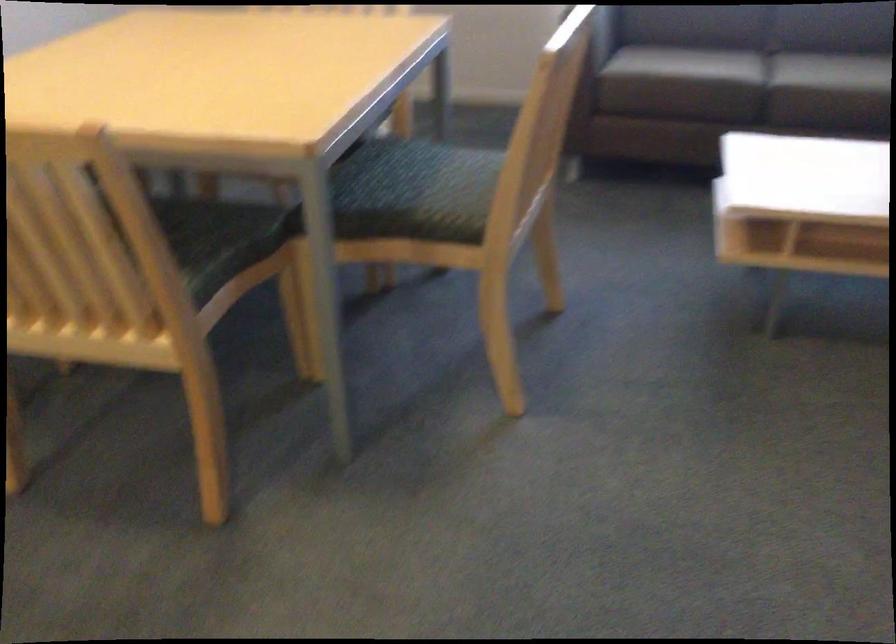
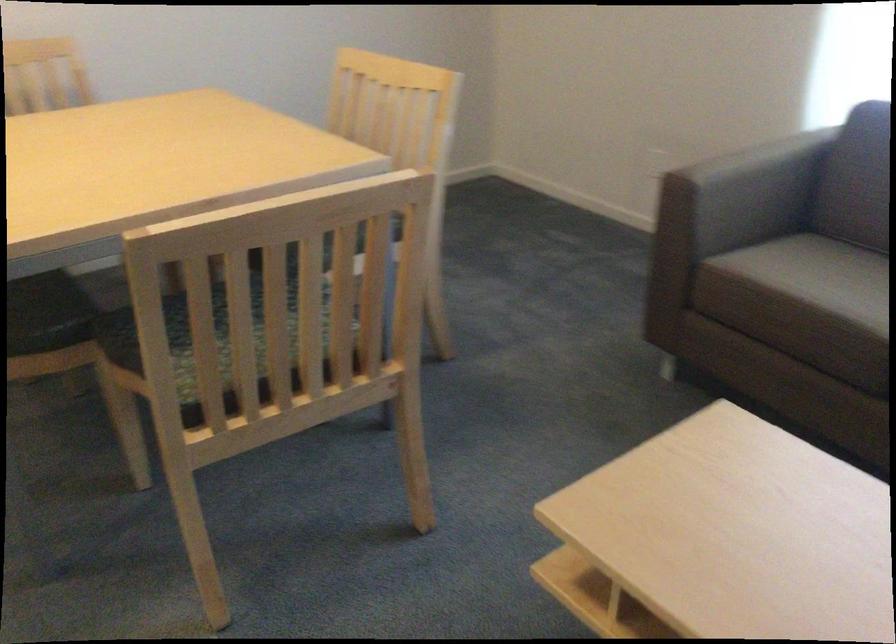
Where in the second image is the point corresponding to the point at 529,146 from the first image?

(211, 334)